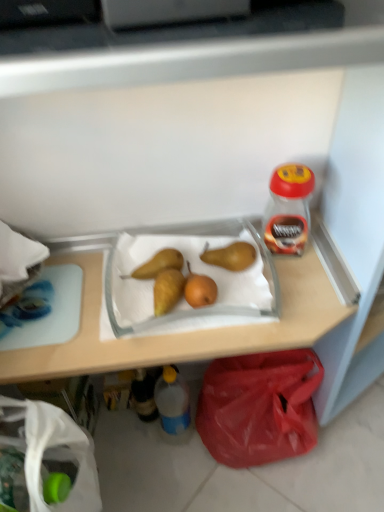
Question: Considering the relative sizes of red plastic bag at lower right and blue translucent bottle at lower center, the 2th bottle when ordered from right to left, in the image provided, is red plastic bag at lower right thinner than blue translucent bottle at lower center, the 2th bottle when ordered from right to left,?

Choices:
 (A) no
 (B) yes

Answer: (A)

Question: From a real-world perspective, is red plastic bag at lower right on top of blue translucent bottle at lower center, which is the third bottle in top-to-bottom order?

Choices:
 (A) yes
 (B) no

Answer: (B)

Question: Can you confirm if red plastic bag at lower right is taller than blue translucent bottle at lower center, which ranks as the 2th bottle in left-to-right order?

Choices:
 (A) yes
 (B) no

Answer: (B)

Question: Can you confirm if red plastic bag at lower right is bigger than blue translucent bottle at lower center, placed as the first bottle when sorted from bottom to top?

Choices:
 (A) yes
 (B) no

Answer: (A)

Question: Is red plastic bag at lower right looking in the opposite direction of blue translucent bottle at lower center, the 2th bottle when ordered from right to left?

Choices:
 (A) no
 (B) yes

Answer: (A)

Question: Considering the relative positions of red plastic bag at lower right and blue translucent bottle at lower center, which is the third bottle in top-to-bottom order, in the image provided, is red plastic bag at lower right in front of blue translucent bottle at lower center, which is the third bottle in top-to-bottom order,?

Choices:
 (A) yes
 (B) no

Answer: (A)

Question: Is white fabric bag at lower left oriented towards translucent plastic bottle at lower center, which ranks as the 1th bottle in left-to-right order?

Choices:
 (A) no
 (B) yes

Answer: (A)

Question: Can you confirm if white fabric bag at lower left is wider than translucent plastic bottle at lower center, the 2th bottle from the top?

Choices:
 (A) no
 (B) yes

Answer: (B)

Question: From a real-world perspective, is white fabric bag at lower left on translucent plastic bottle at lower center, which ranks as the 1th bottle in left-to-right order?

Choices:
 (A) yes
 (B) no

Answer: (A)

Question: Does white fabric bag at lower left come behind translucent plastic bottle at lower center, which ranks as the 1th bottle in left-to-right order?

Choices:
 (A) no
 (B) yes

Answer: (A)

Question: From the image's perspective, is white fabric bag at lower left on top of translucent plastic bottle at lower center, which ranks as the 1th bottle in left-to-right order?

Choices:
 (A) no
 (B) yes

Answer: (A)

Question: Does white fabric bag at lower left have a smaller size compared to translucent plastic bottle at lower center, the 3th bottle positioned from the right?

Choices:
 (A) yes
 (B) no

Answer: (B)

Question: Is translucent plastic bottle at lower center, which ranks as the 1th bottle in left-to-right order, at the left side of white fabric bag at lower left?

Choices:
 (A) yes
 (B) no

Answer: (B)